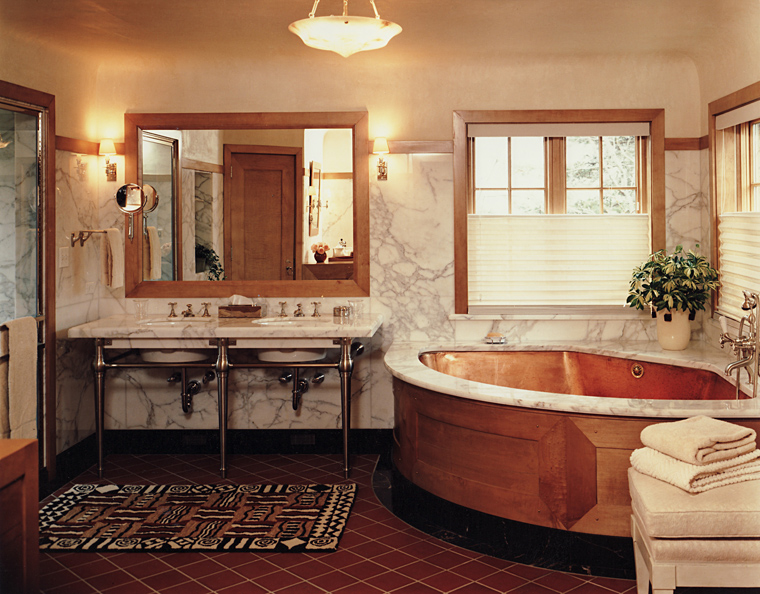
This screenshot has height=594, width=760. What are the coordinates of `plant` in the screenshot? It's located at (673, 280).